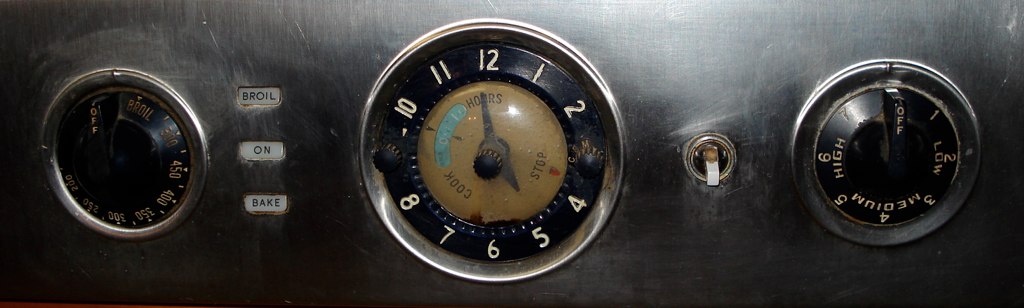
This screenshot has width=1024, height=308. I want to click on timer knob, so click(x=486, y=162).